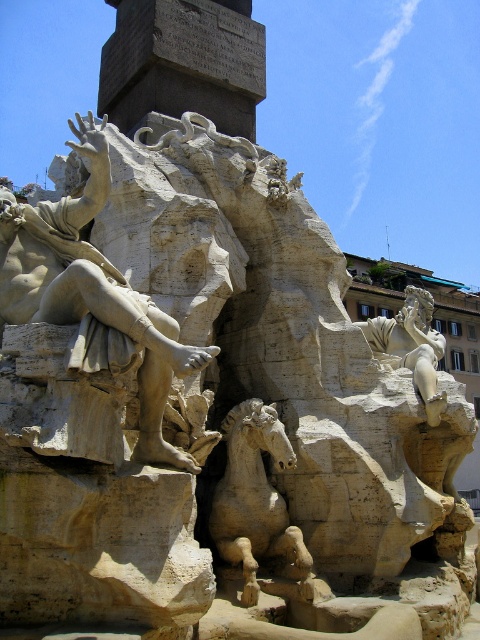
Which is more to the left, white marble statue at left or white stone horse at center?

white marble statue at left is more to the left.

Consider the image. How far apart are white marble statue at left and white stone horse at center?

They are 11.91 meters apart.

Is point (201, 358) positioned behind point (267, 499)?

No, (201, 358) is closer to viewer.

Find the location of a particular element. Image resolution: width=480 pixels, height=640 pixels. white marble statue at left is located at coordinates (93, 296).

In the scene shown: Does white marble statue at left have a smaller size compared to smooth beige statue at upper right?

Yes, white marble statue at left is smaller than smooth beige statue at upper right.

Does point (207, 355) come closer to viewer compared to point (440, 401)?

Yes, it is.

You are a GUI agent. You are given a task and a screenshot of the screen. Output one action in this format:
    pyautogui.click(x=<x>, y=<y>)
    Task: Click on the white marble statue at left
    
    Given the screenshot: What is the action you would take?
    pyautogui.click(x=93, y=296)

Is white stone horse at center smaller than smooth beige statue at upper right?

Yes.

This screenshot has width=480, height=640. I want to click on white stone horse at center, so click(255, 499).

You are a GUI agent. You are given a task and a screenshot of the screen. Output one action in this format:
    pyautogui.click(x=<x>, y=<y>)
    Task: Click on the white stone horse at center
    This screenshot has width=480, height=640.
    Given the screenshot: What is the action you would take?
    pyautogui.click(x=255, y=499)